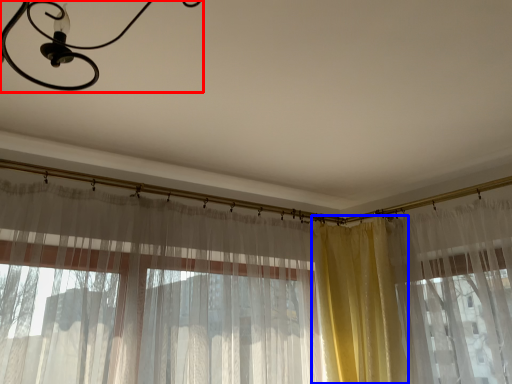
Question: Which point is closer to the camera, light fixture (highlighted by a red box) or curtain (highlighted by a blue box)?

Choices:
 (A) light fixture
 (B) curtain

Answer: (A)